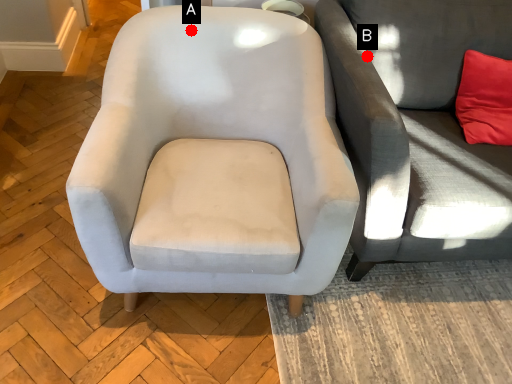
Question: Two points are circled on the image, labeled by A and B beside each circle. Which point is further to the camera?

Choices:
 (A) A is further
 (B) B is further

Answer: (B)